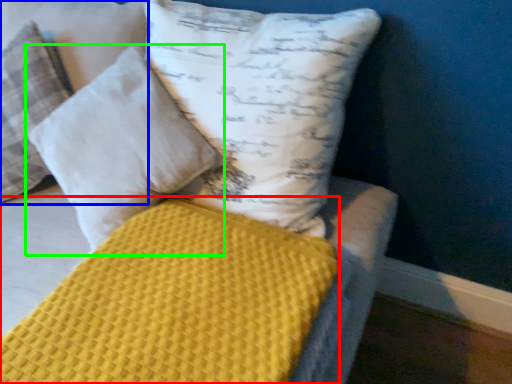
Question: Which object is positioned closest to mattress (highlighted by a red box)? Select from pillow (highlighted by a blue box) and pillow (highlighted by a green box).

Choices:
 (A) pillow
 (B) pillow

Answer: (B)